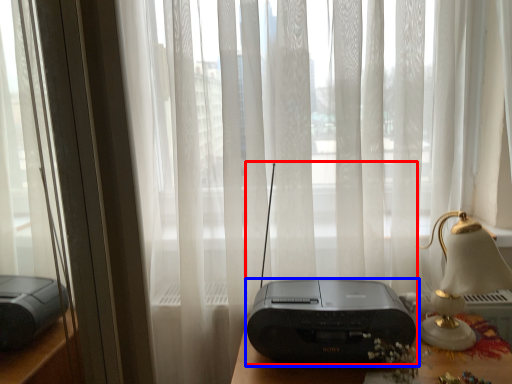
Question: Which object is further to the camera taking this photo, gadget (highlighted by a red box) or printer (highlighted by a blue box)?

Choices:
 (A) gadget
 (B) printer

Answer: (B)